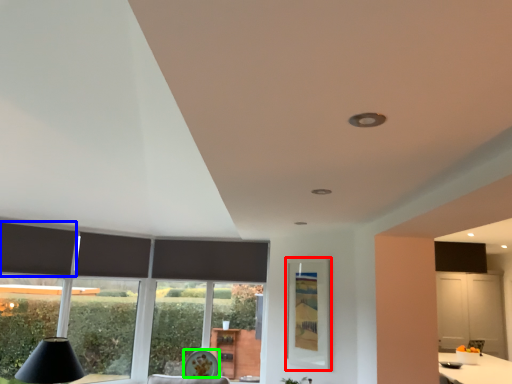
Question: Based on their relative distances, which object is nearer to window screen (highlighted by a red box)? Choose from curtain (highlighted by a blue box) and round table (highlighted by a green box).

Choices:
 (A) curtain
 (B) round table

Answer: (B)